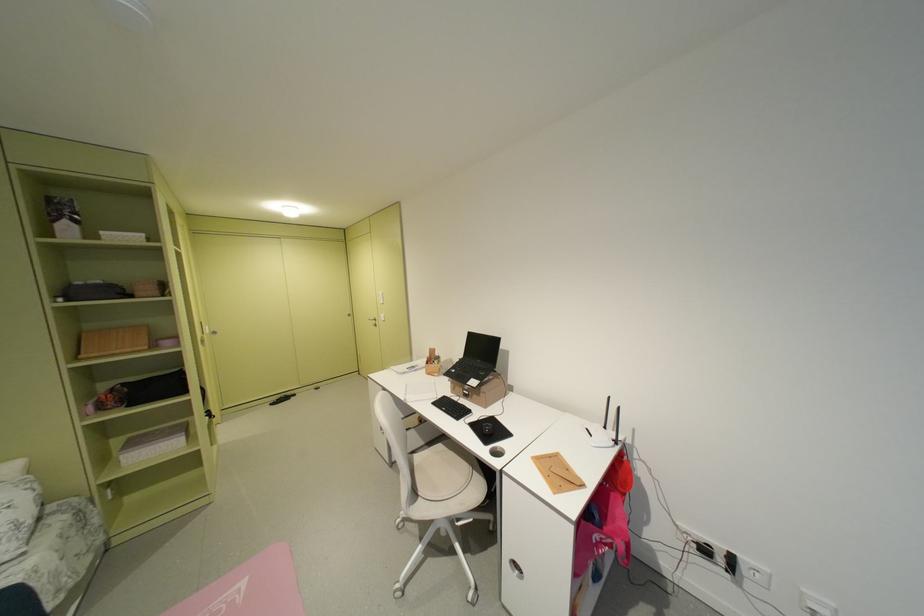
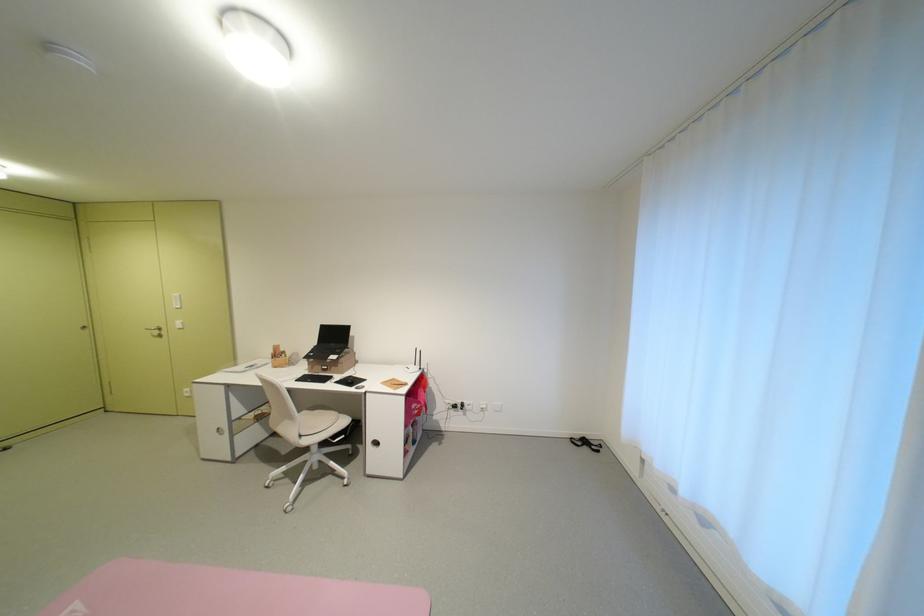
Where in the second image is the point corresponding to point 393,435 from the first image?

(232, 435)